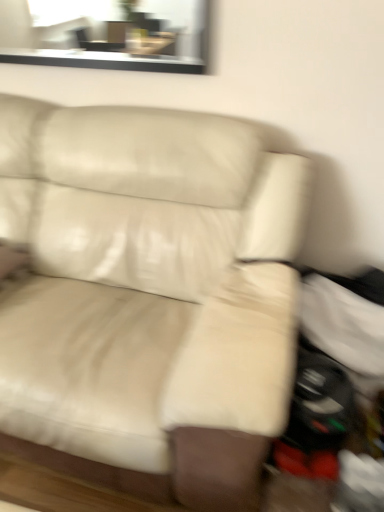
The width and height of the screenshot is (384, 512). Describe the element at coordinates (148, 297) in the screenshot. I see `matte leather couch at center` at that location.

Find the location of a particular element. This screenshot has height=512, width=384. matte leather couch at center is located at coordinates (148, 297).

This screenshot has width=384, height=512. In order to click on matte leather couch at center in this screenshot , I will do `click(148, 297)`.